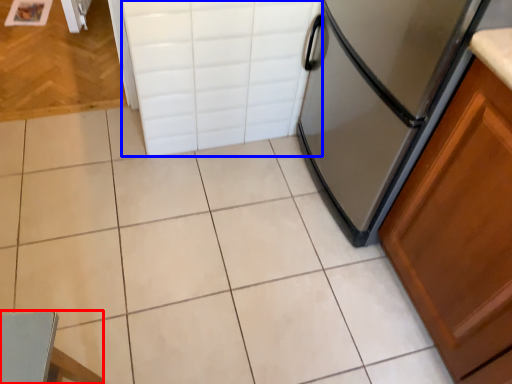
Question: Which object is closer to the camera taking this photo, chair (highlighted by a red box) or drawer (highlighted by a blue box)?

Choices:
 (A) chair
 (B) drawer

Answer: (A)